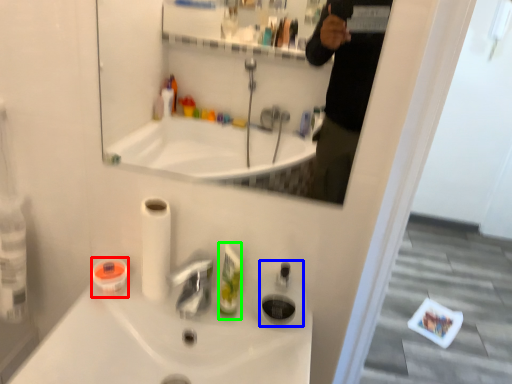
Question: Estimate the real-world distances between objects in this image. Which object is closer to mouthwash (highlighted by a red box), soap dispenser (highlighted by a blue box) or mouthwash (highlighted by a green box)?

Choices:
 (A) soap dispenser
 (B) mouthwash

Answer: (B)